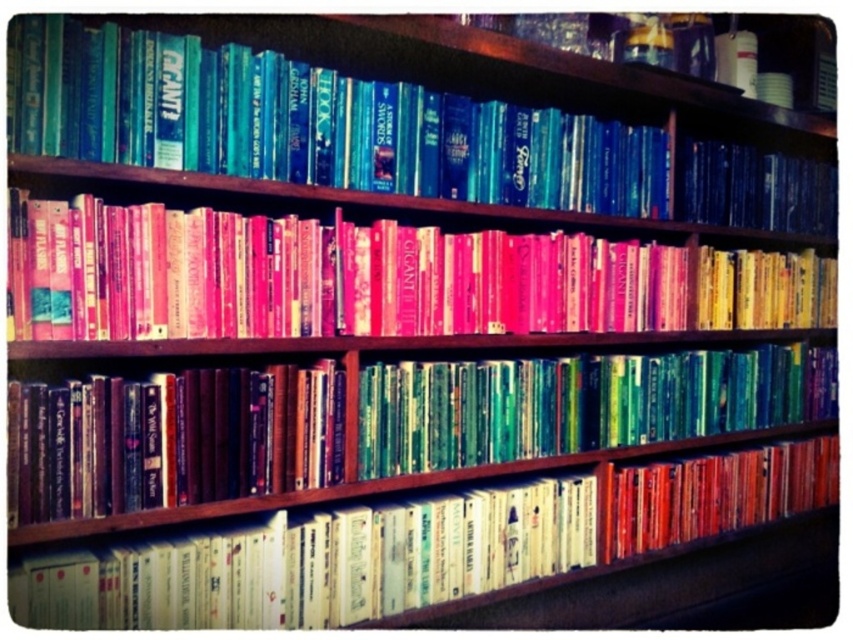
Question: Is hardcover book at center positioned in front of yellow paperbacks at center?

Choices:
 (A) yes
 (B) no

Answer: (A)

Question: Among these points, which one is farthest from the camera?

Choices:
 (A) (624, 545)
 (B) (674, 432)

Answer: (B)

Question: Which object is positioned farthest from the shiny green book at center?

Choices:
 (A) matte orange book at lower right
 (B) hardcover book at center

Answer: (B)

Question: Can you confirm if teal hardcover book at upper left is positioned to the left of hardcover book at center?

Choices:
 (A) no
 (B) yes

Answer: (A)

Question: Among these points, which one is nearest to the camera?

Choices:
 (A) (165, 72)
 (B) (703, 284)

Answer: (A)

Question: Can you confirm if pink matte book at center is smaller than shiny green book at center?

Choices:
 (A) no
 (B) yes

Answer: (A)